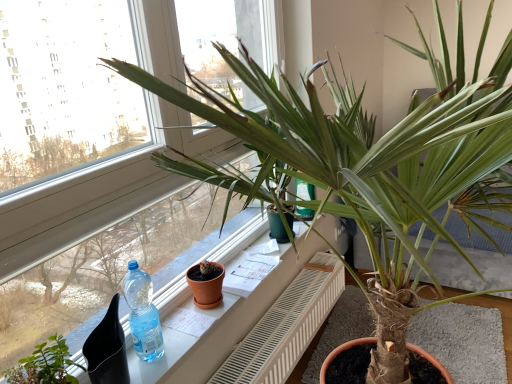
Find the location of a particular element. vacant area that lies between terracotta clay pot at center and transparent plastic bottle at window is located at coordinates (x=184, y=323).